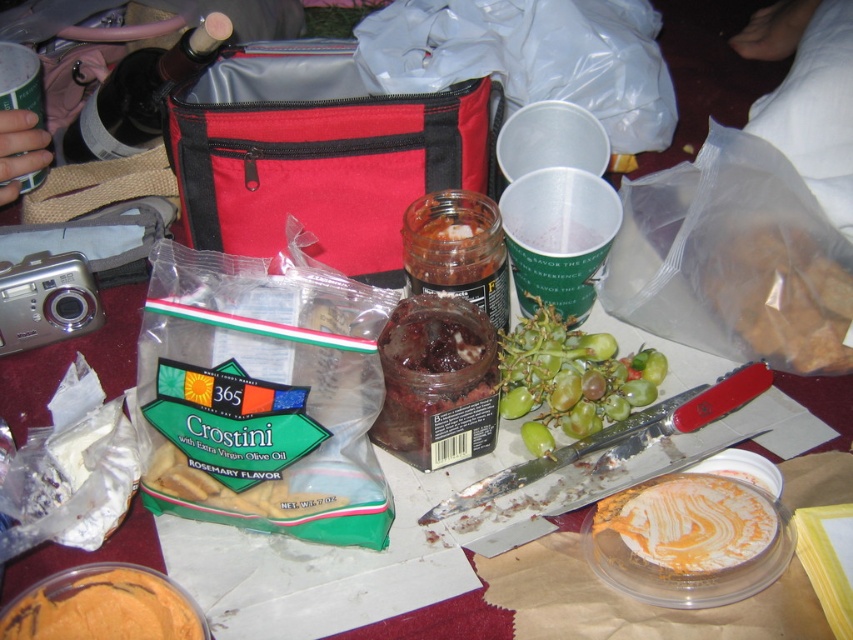
You are a person with a height of 5 feet 6 inches. You are sitting at the dining setup and want to reach the shiny glass jar at center. Can you comfortably reach it without standing up?

The shiny glass jar at center is 33.99 inches away from the viewer. Since the average arm length for a person of 5 feet 6 inches is around 25 to 28 inches, the distance is beyond comfortable reach. Therefore, you might need to adjust your position or lean forward to reach it comfortably.

You are setting up a picnic and have both the shiny dark red jam at center and the brown crumbly at center on your plate. Which of these two items takes up more space on the plate?

The shiny dark red jam at center takes up more space on the plate since it is bigger than the brown crumbly at center.